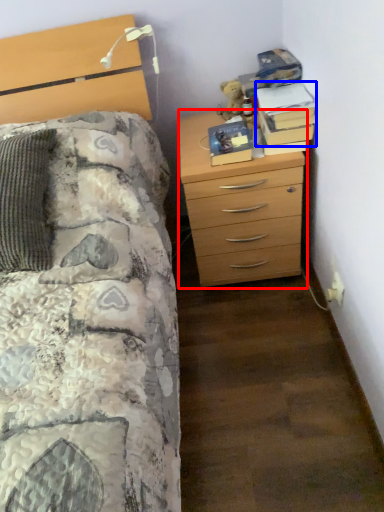
Question: Which object is closer to the camera taking this photo, chest of drawers (highlighted by a red box) or book (highlighted by a blue box)?

Choices:
 (A) chest of drawers
 (B) book

Answer: (A)